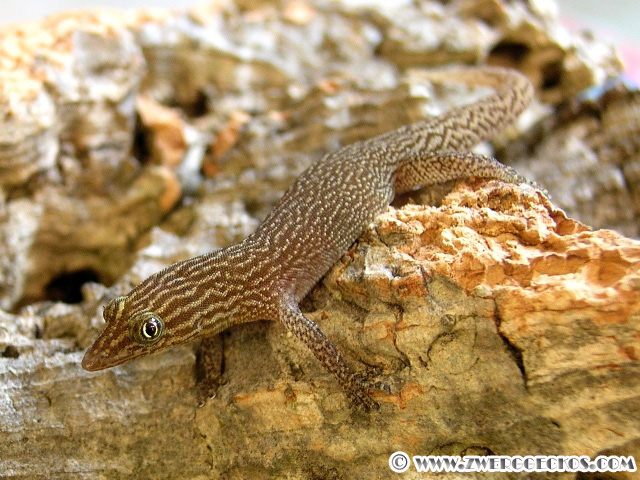
Image resolution: width=640 pixels, height=480 pixels. What are the coordinates of `left front leg` in the screenshot? It's located at (329, 360).